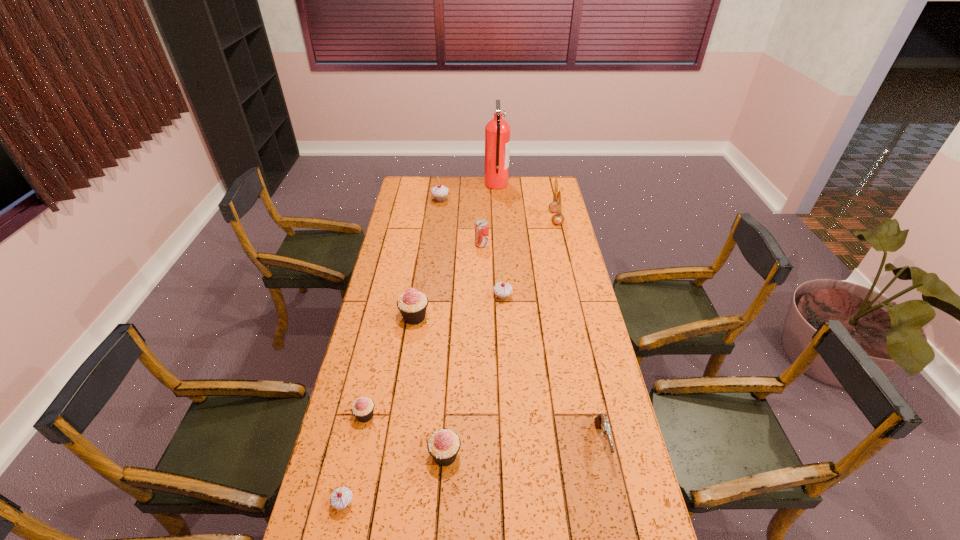
The height and width of the screenshot is (540, 960). I want to click on free space located 0.380m at the nozzle of the fire extinguisher, so click(418, 184).

Locate an element on the screen. The image size is (960, 540). free space located at the nozzle of the fire extinguisher is located at coordinates (428, 184).

Identify the location of free region located 0.180m on the front-facing side of the earphone. The image size is (960, 540). pos(514,218).

The width and height of the screenshot is (960, 540). I want to click on free space located 0.250m on the front-facing side of the earphone, so click(500, 218).

At what (x,y) coordinates should I click in order to perform the action: click on blank space located on the front-facing side of the earphone. Please return your answer as a coordinate pair (x, y). Looking at the image, I should click on (538, 218).

Locate an element on the screen. The width and height of the screenshot is (960, 540). free space located 0.350m on the right of the farthest cupcake is located at coordinates (515, 200).

In order to click on blank area located 0.180m on the right of the third farthest cupcake in this screenshot , I will do `click(476, 317)`.

Where is `free space located on the front of the pink soda can`? This screenshot has height=540, width=960. free space located on the front of the pink soda can is located at coordinates (482, 293).

The image size is (960, 540). Find the location of `free space located 0.340m on the back of the second smallest gray cupcake`. free space located 0.340m on the back of the second smallest gray cupcake is located at coordinates (499, 242).

The height and width of the screenshot is (540, 960). I want to click on vacant position located on the right of the second nearest cupcake, so click(x=509, y=455).